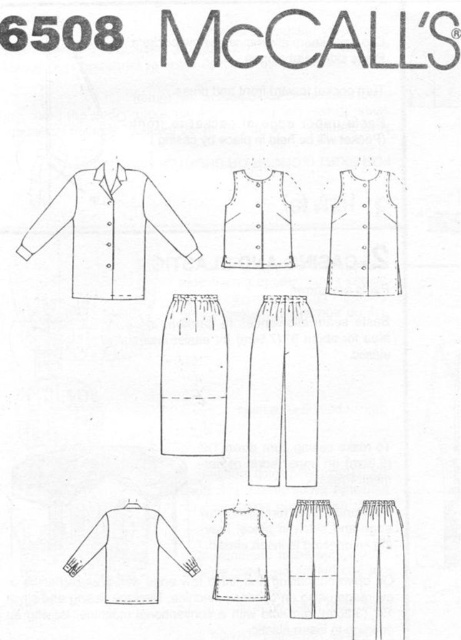
Can you confirm if white cotton shirt at upper left is wider than white cotton shirt at lower left?

Correct, the width of white cotton shirt at upper left exceeds that of white cotton shirt at lower left.

Does white cotton shirt at upper left have a larger size compared to white cotton shirt at lower left?

Yes.

Identify the location of white cotton shirt at upper left. (108, 228).

Image resolution: width=461 pixels, height=640 pixels. Describe the element at coordinates (108, 228) in the screenshot. I see `white cotton shirt at upper left` at that location.

Can you confirm if white cotton shirt at upper left is wider than matte white vest at center?

Indeed, white cotton shirt at upper left has a greater width compared to matte white vest at center.

Describe the element at coordinates (108, 228) in the screenshot. The width and height of the screenshot is (461, 640). I see `white cotton shirt at upper left` at that location.

Image resolution: width=461 pixels, height=640 pixels. Find the location of `white cotton shirt at upper left`. white cotton shirt at upper left is located at coordinates (108, 228).

Is matte white vest at upper center to the left of matte white vest at center from the viewer's perspective?

Incorrect, matte white vest at upper center is not on the left side of matte white vest at center.

Is matte white vest at upper center taller than matte white vest at center?

Yes.

Find the location of a particular element. Image resolution: width=461 pixels, height=640 pixels. matte white vest at upper center is located at coordinates (364, 236).